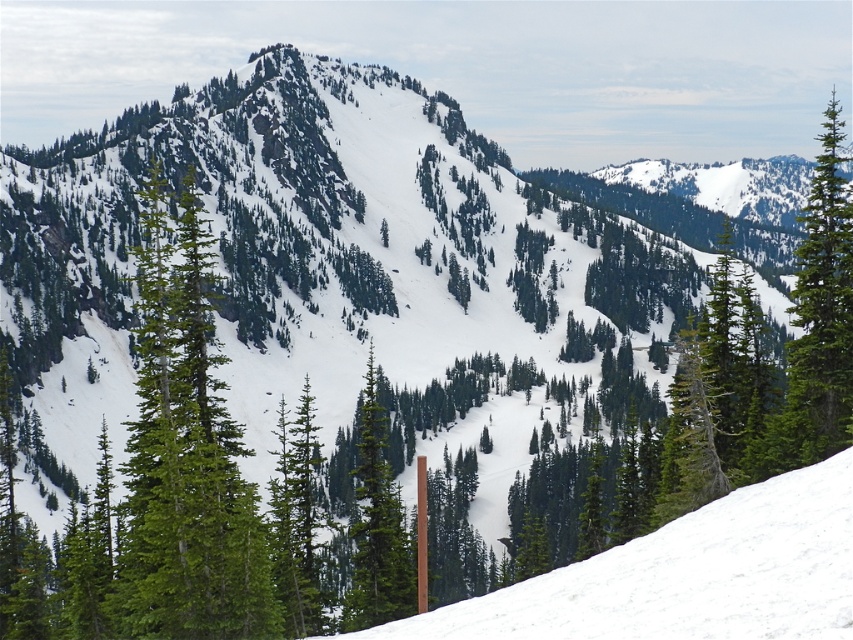
Which is more to the right, green matte tree at center or green matte tree at right?

From the viewer's perspective, green matte tree at right appears more on the right side.

Who is positioned more to the left, green matte tree at center or green matte tree at right?

From the viewer's perspective, green matte tree at center appears more on the left side.

Identify the location of green matte tree at center. (186, 456).

The height and width of the screenshot is (640, 853). What are the coordinates of `green matte tree at center` in the screenshot? It's located at tap(186, 456).